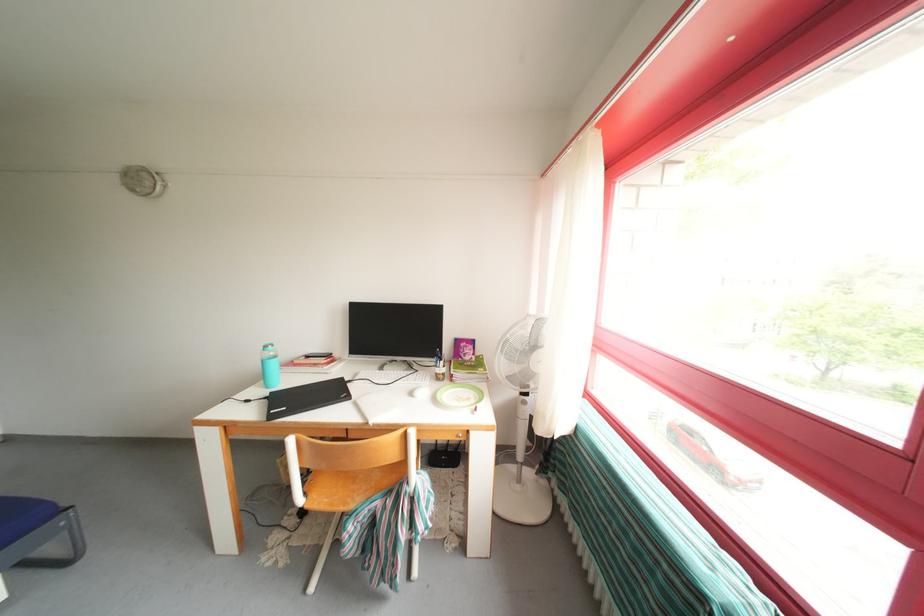
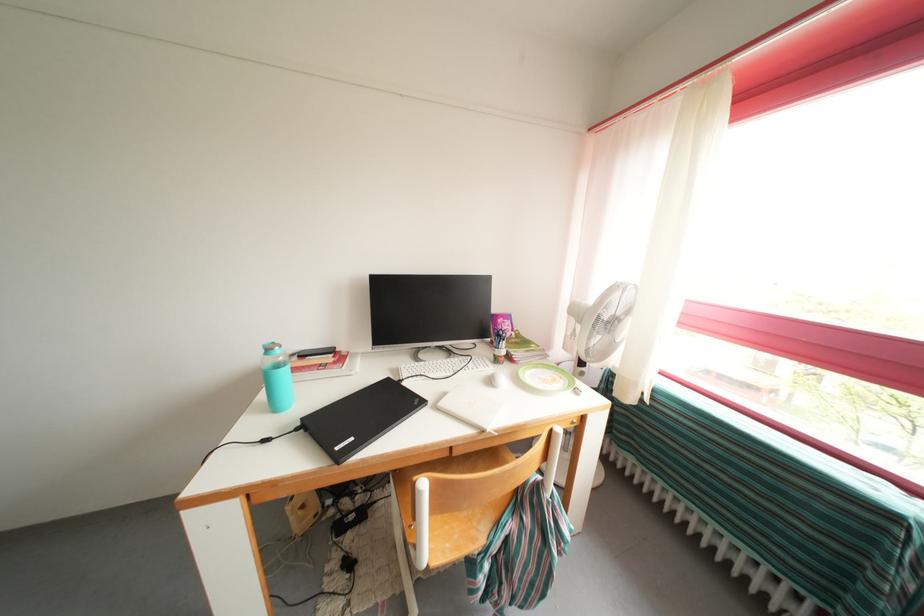
Question: The images are taken continuously from a first-person perspective. In which direction is your viewpoint rotating?

Choices:
 (A) Left
 (B) Right
 (C) Up
 (D) Down

Answer: (B)